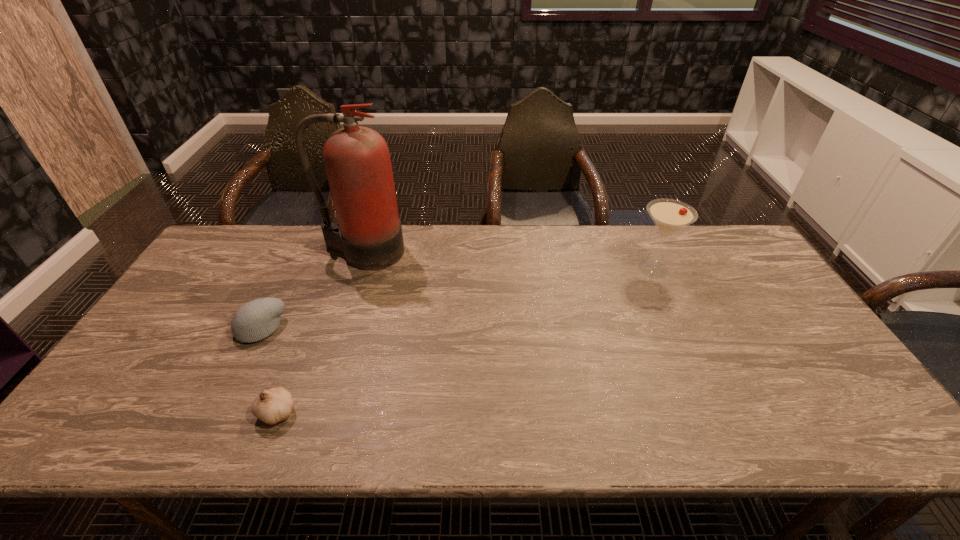
Find the location of a particular element. free space that is in between the beanie and the nearest object is located at coordinates (269, 370).

Where is `blank region between the second tallest object and the leftmost object`? This screenshot has height=540, width=960. blank region between the second tallest object and the leftmost object is located at coordinates (457, 299).

At what (x,y) coordinates should I click in order to perform the action: click on vacant space that is in between the martini and the fire extinguisher. Please return your answer as a coordinate pair (x, y). Looking at the image, I should click on (508, 260).

At what (x,y) coordinates should I click in order to perform the action: click on empty location between the leftmost object and the garlic. Please return your answer as a coordinate pair (x, y). The image size is (960, 540). Looking at the image, I should click on (269, 370).

The width and height of the screenshot is (960, 540). I want to click on vacant point located between the fire extinguisher and the leftmost object, so click(311, 290).

Locate an element on the screen. vacant space that is in between the nearest object and the leftmost object is located at coordinates (269, 370).

You are a GUI agent. You are given a task and a screenshot of the screen. Output one action in this format:
    pyautogui.click(x=<x>, y=<y>)
    Task: Click on the empty location between the tallest object and the martini
    
    Given the screenshot: What is the action you would take?
    pyautogui.click(x=508, y=260)

Locate an element on the screen. The width and height of the screenshot is (960, 540). object that is the third closest to the tallest object is located at coordinates (669, 215).

The height and width of the screenshot is (540, 960). Find the location of `object that is the nearest to the tallest object`. object that is the nearest to the tallest object is located at coordinates (256, 320).

What are the coordinates of `blank space that satisfies the following two spatial constraints: 1. on the front side of the leftmost object; 2. on the right side of the nearest object` in the screenshot? It's located at (218, 411).